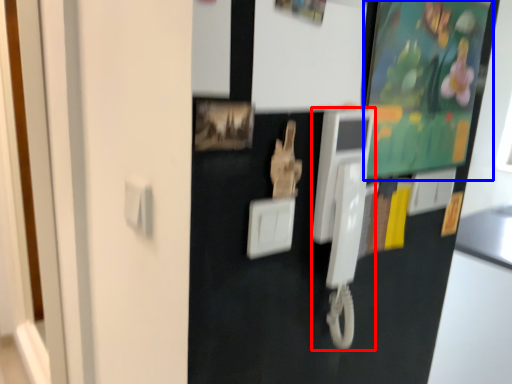
Question: Which object appears closest to the camera in this image, payphone (highlighted by a red box) or bulletin board (highlighted by a blue box)?

Choices:
 (A) payphone
 (B) bulletin board

Answer: (A)